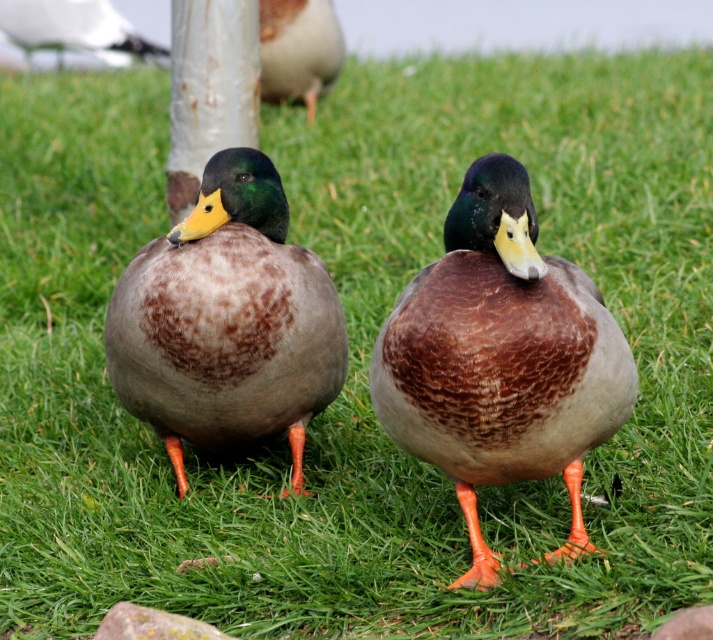
Question: Does rusty metal pole at upper center appear on the left side of white glossy seagull at upper left?

Choices:
 (A) yes
 (B) no

Answer: (B)

Question: Can you confirm if matte brown duck at center is positioned above rusty metal pole at upper center?

Choices:
 (A) no
 (B) yes

Answer: (A)

Question: Which is farther from the rusty metal pole at upper center?

Choices:
 (A) white glossy seagull at upper left
 (B) matte brown duck at center
 (C) brown feathered duck at center

Answer: (B)

Question: Which of the following is the closest to the observer?

Choices:
 (A) white glossy seagull at upper left
 (B) matte brown duck at center
 (C) brown feathered duck at center
 (D) brown speckled duck at center

Answer: (B)

Question: Which of the following is the farthest from the observer?

Choices:
 (A) (482, 211)
 (B) (329, 20)
 (C) (0, 12)
 (D) (217, 124)

Answer: (C)

Question: Does rusty metal pole at upper center have a greater width compared to white glossy seagull at upper left?

Choices:
 (A) yes
 (B) no

Answer: (A)